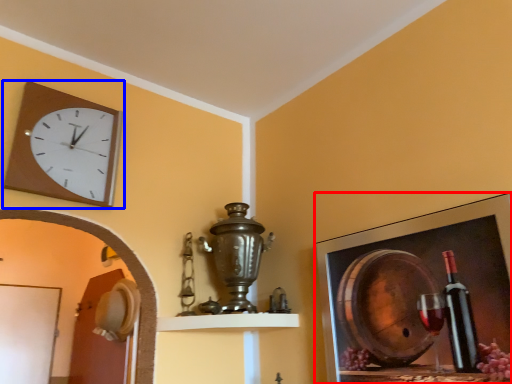
Question: Which object is closer to the camera taking this photo, picture frame (highlighted by a red box) or wall clock (highlighted by a blue box)?

Choices:
 (A) picture frame
 (B) wall clock

Answer: (A)